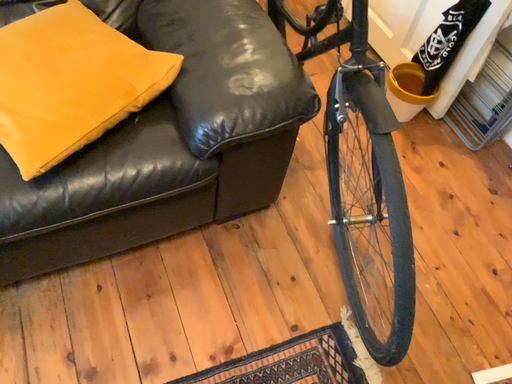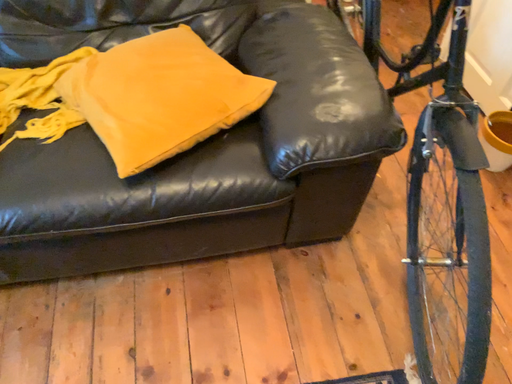
Question: Which way did the camera rotate in the video?

Choices:
 (A) rotated left
 (B) rotated right

Answer: (A)